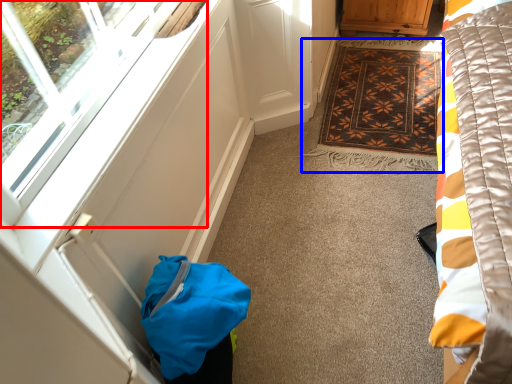
Question: Which point is further to the camera, window (highlighted by a red box) or mat (highlighted by a blue box)?

Choices:
 (A) window
 (B) mat

Answer: (B)